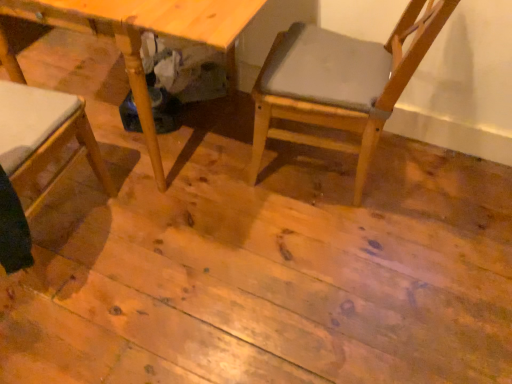
Question: Is light brown wood chair at center positioned with its back to natural wood table at center?

Choices:
 (A) no
 (B) yes

Answer: (A)

Question: Is light brown wood chair at center aimed at natural wood table at center?

Choices:
 (A) yes
 (B) no

Answer: (A)

Question: Does light brown wood chair at center have a lesser height compared to natural wood table at center?

Choices:
 (A) no
 (B) yes

Answer: (A)

Question: Is light brown wood chair at center at the right side of natural wood table at center?

Choices:
 (A) yes
 (B) no

Answer: (A)

Question: Is the depth of light brown wood chair at center less than that of natural wood table at center?

Choices:
 (A) yes
 (B) no

Answer: (A)

Question: Is light brown wood chair at center in contact with natural wood table at center?

Choices:
 (A) yes
 (B) no

Answer: (B)

Question: Is the position of natural wood table at center more distant than that of light brown wood chair at center?

Choices:
 (A) no
 (B) yes

Answer: (B)

Question: Considering the relative positions of natural wood table at center and light brown wood chair at center in the image provided, is natural wood table at center to the right of light brown wood chair at center from the viewer's perspective?

Choices:
 (A) no
 (B) yes

Answer: (A)

Question: Is natural wood table at center looking in the opposite direction of light brown wood chair at center?

Choices:
 (A) yes
 (B) no

Answer: (B)

Question: Considering the relative sizes of natural wood table at center and light brown wood chair at center in the image provided, is natural wood table at center shorter than light brown wood chair at center?

Choices:
 (A) yes
 (B) no

Answer: (A)

Question: Are natural wood table at center and light brown wood chair at center making contact?

Choices:
 (A) no
 (B) yes

Answer: (A)

Question: Can you confirm if natural wood table at center is wider than light brown wood chair at center?

Choices:
 (A) no
 (B) yes

Answer: (B)

Question: From the image's perspective, is light brown wood chair at center above or below natural wood table at center?

Choices:
 (A) above
 (B) below

Answer: (B)